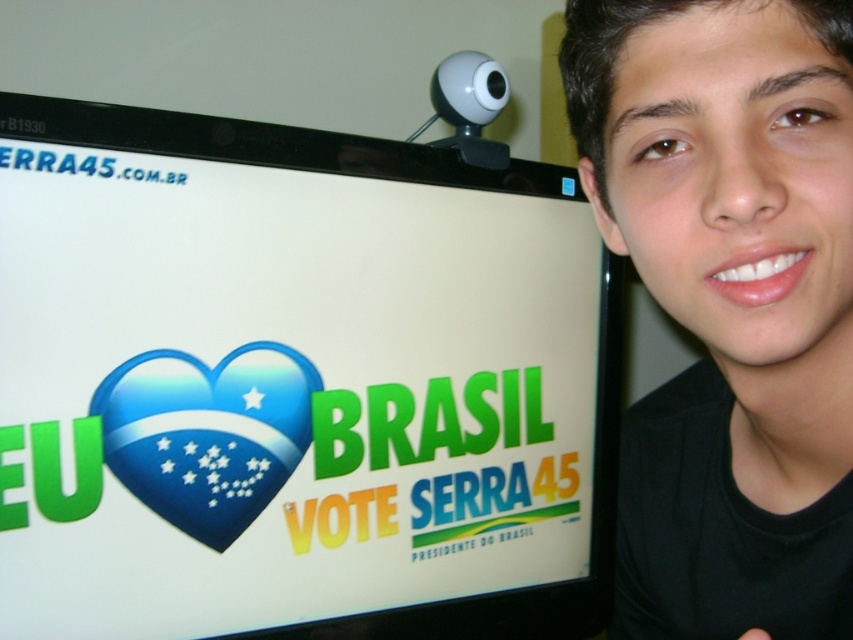
Question: From the image, what is the correct spatial relationship of white glossy computer screen at upper center in relation to black matte face at upper right?

Choices:
 (A) below
 (B) above

Answer: (B)

Question: Is white glossy computer screen at upper center thinner than black matte face at upper right?

Choices:
 (A) no
 (B) yes

Answer: (A)

Question: Is white glossy computer screen at upper center closer to camera compared to black matte face at upper right?

Choices:
 (A) yes
 (B) no

Answer: (B)

Question: Which point is closer to the camera?

Choices:
 (A) (752, 180)
 (B) (236, 248)

Answer: (A)